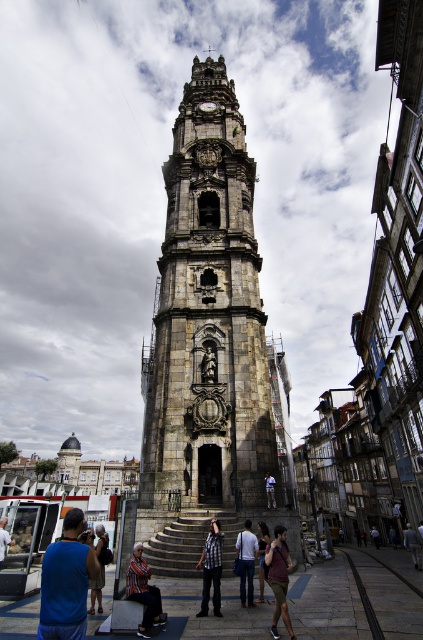
Which of these two, white cotton shirt at center or light brown leather jacket at lower right, stands taller?

white cotton shirt at center is taller.

Can you confirm if white cotton shirt at center is thinner than light brown leather jacket at lower right?

Correct, white cotton shirt at center's width is less than light brown leather jacket at lower right's.

What do you see at coordinates (247, 561) in the screenshot? The width and height of the screenshot is (423, 640). I see `white cotton shirt at center` at bounding box center [247, 561].

Where is `white cotton shirt at center`? white cotton shirt at center is located at coordinates (247, 561).

Is striped fabric at center to the left of matte gray clock at center from the viewer's perspective?

Indeed, striped fabric at center is positioned on the left side of matte gray clock at center.

Is striped fabric at center below matte gray clock at center?

Indeed, striped fabric at center is positioned under matte gray clock at center.

Is point (153, 602) less distant than point (214, 106)?

Yes, point (153, 602) is closer to viewer.

Where is `striped fabric at center`? striped fabric at center is located at coordinates (142, 592).

Who is more distant from viewer, (209, 552) or (264, 483)?

Positioned behind is point (264, 483).

Does checkered fabric shirt at center have a greater width compared to light blue shirt at center?

Yes, checkered fabric shirt at center is wider than light blue shirt at center.

Who is more distant from viewer, (203,548) or (268,481)?

The point (268,481) is more distant.

At what (x,y) coordinates should I click in order to perform the action: click on checkered fabric shirt at center. Please return your answer as a coordinate pair (x, y). Looking at the image, I should click on (211, 568).